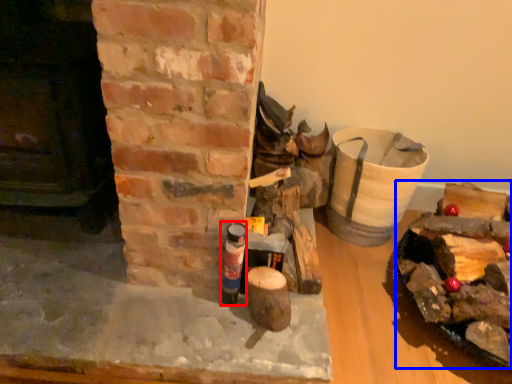
Question: Which point is further to the camera, bottle (highlighted by a red box) or debris (highlighted by a blue box)?

Choices:
 (A) bottle
 (B) debris

Answer: (A)